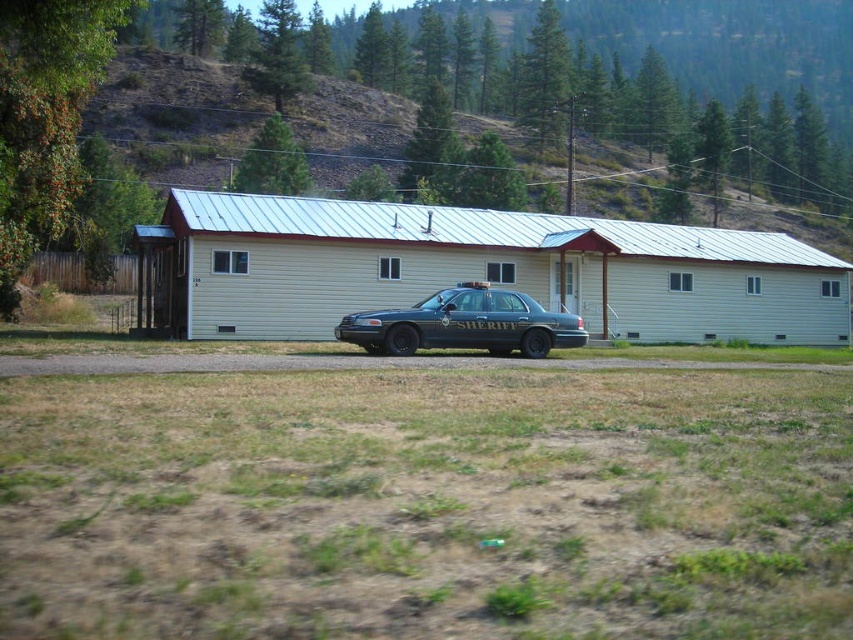
You are a drone operator trying to capture aerial footage of the green grass at upper center and the metallic blue sheriff car at center. Your drone has a maximum range of 50 meters. Can your drone reach both objects without exceeding its range?

The green grass at upper center and metallic blue sheriff car at center are 56.81 meters apart from each other. Since the drone has a maximum range of 50 meters, it cannot reach both objects without exceeding its range.

You are a photographer trying to capture a clear photo of the metallic blue sheriff car at center. However, the green grass at upper center is blocking your view. Can you determine if the grass is tall enough to obstruct the car?

The green grass at upper center is much taller than the metallic blue sheriff car at center, so it will likely obstruct the view of the car.

You are a pedestrian standing on the dirt road in front of the building. You see the metallic blue sheriff car at center and the green grass at upper center. Which object is closer to you?

The metallic blue sheriff car at center is behind the green grass at upper center, so the green grass at upper center is closer to you.